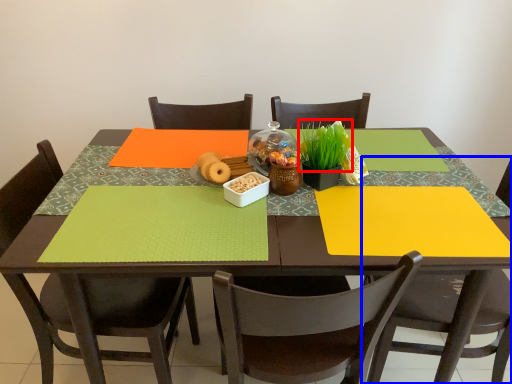
Question: Which of the following is the closest to the observer, plant (highlighted by a red box) or chair (highlighted by a blue box)?

Choices:
 (A) plant
 (B) chair

Answer: (B)